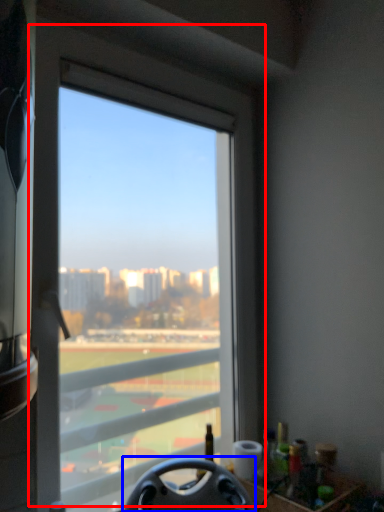
Question: Among these objects, which one is nearest to the camera, window (highlighted by a red box) or steering wheel (highlighted by a blue box)?

Choices:
 (A) window
 (B) steering wheel

Answer: (B)